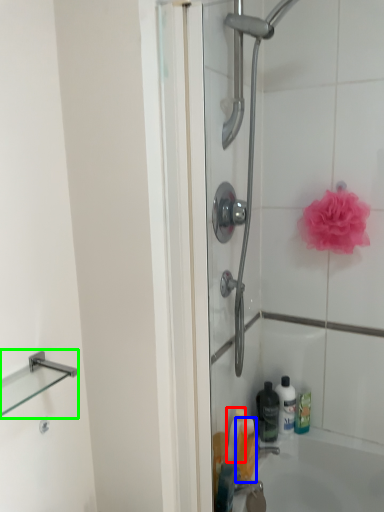
Question: Based on their relative distances, which object is farther from cleaning product (highlighted by a red box)? Choose from toiletry (highlighted by a blue box) and balustrade (highlighted by a green box).

Choices:
 (A) toiletry
 (B) balustrade

Answer: (B)